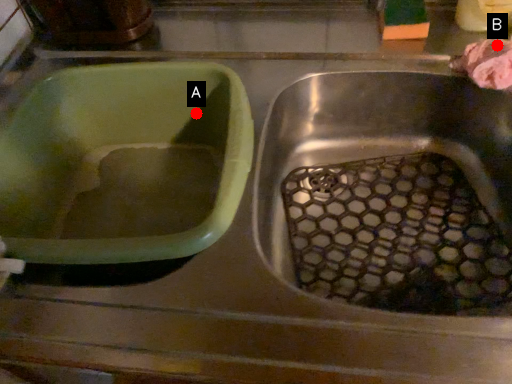
Question: Two points are circled on the image, labeled by A and B beside each circle. Which point is closer to the camera?

Choices:
 (A) A is closer
 (B) B is closer

Answer: (B)